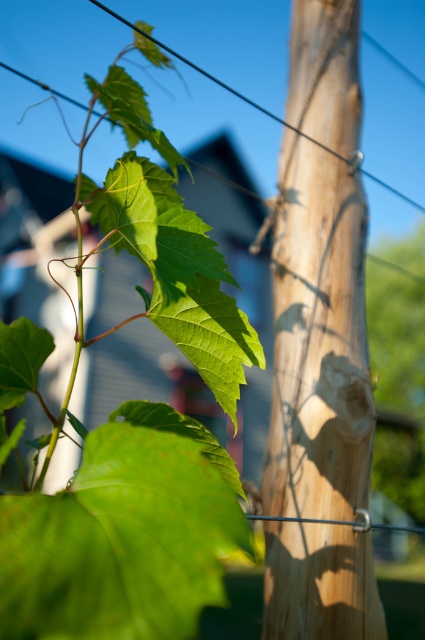
Can you confirm if green matte leaf at upper left is bigger than wooden telegraph pole at center?

Correct, green matte leaf at upper left is larger in size than wooden telegraph pole at center.

Can you confirm if green matte leaf at upper left is positioned above wooden telegraph pole at center?

No, green matte leaf at upper left is not above wooden telegraph pole at center.

Which is in front, point (132, 440) or point (325, 232)?

Positioned in front is point (132, 440).

At what (x,y) coordinates should I click in order to perform the action: click on green matte leaf at upper left. Please return your answer as a coordinate pair (x, y). This screenshot has height=640, width=425. Looking at the image, I should click on (135, 429).

Can you confirm if green matte leaf at lower left is positioned to the left of green matte leaf at center?

Yes, green matte leaf at lower left is to the left of green matte leaf at center.

Is point (161, 625) behind point (189, 349)?

No, (161, 625) is closer to viewer.

Which is behind, point (229, 486) or point (195, 348)?

The point (195, 348) is behind.

The width and height of the screenshot is (425, 640). I want to click on green matte leaf at lower left, so click(119, 541).

Who is positioned more to the left, green matte leaf at lower left or green matte leaf at upper center?

green matte leaf at upper center

Does green matte leaf at lower left lie behind green matte leaf at upper center?

No, green matte leaf at lower left is closer to the viewer.

Between point (39, 570) and point (149, 141), which one is positioned behind?

Point (149, 141)

At what (x,y) coordinates should I click in order to perform the action: click on green matte leaf at lower left. Please return your answer as a coordinate pair (x, y). This screenshot has height=640, width=425. Looking at the image, I should click on (119, 541).